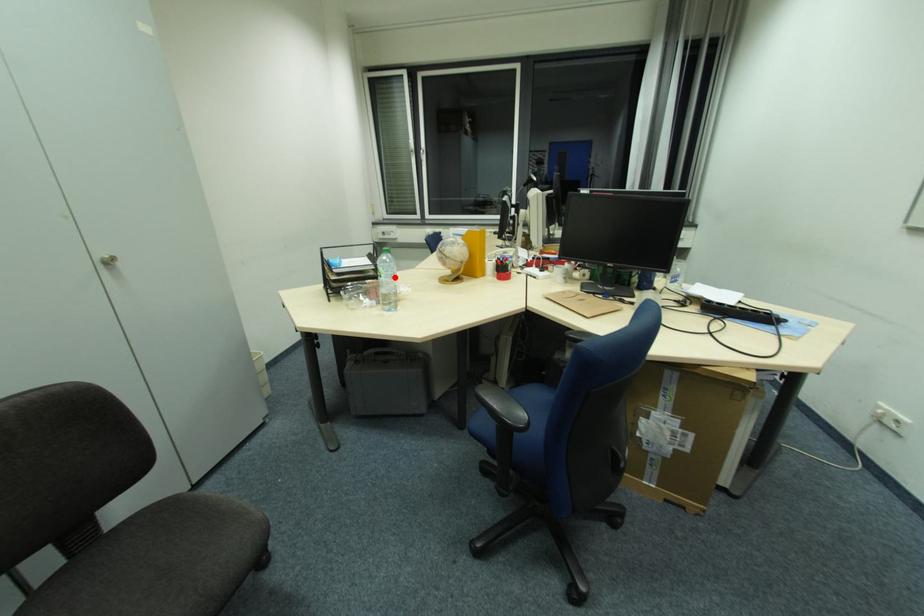
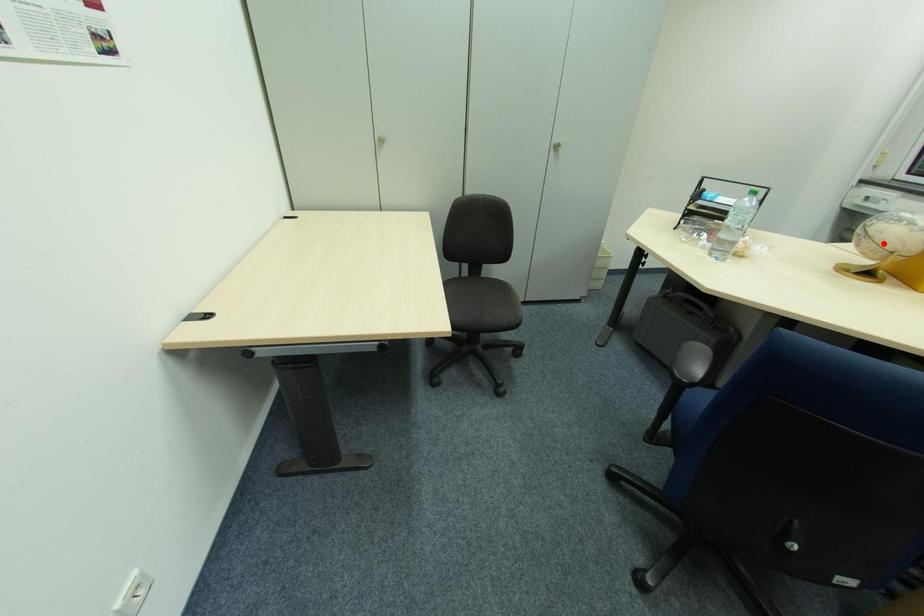
I am providing you with two images of the same scene from different viewpoints. A red point is marked on the first image and another point is marked on the second image. Do the highlighted points in image1 and image2 indicate the same real-world spot?

No